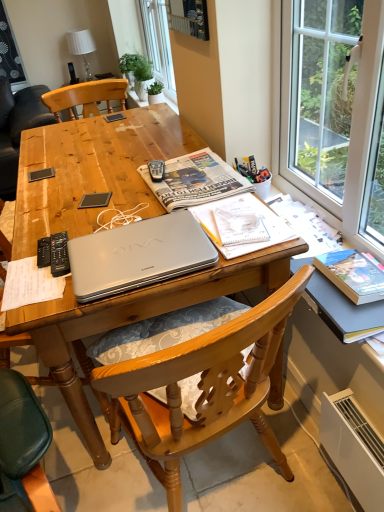
Identify the location of free space to the back side of silver metallic laptop at center. (145, 147).